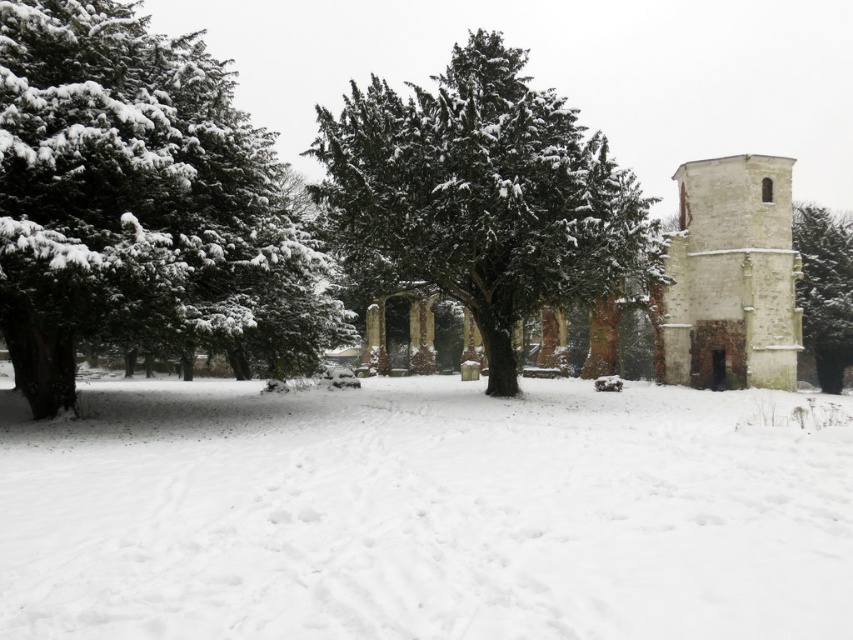
Does snow-covered evergreen tree at center lie in front of green textured stone column at right?

Yes, snow-covered evergreen tree at center is in front of green textured stone column at right.

Does point (492, 340) lie in front of point (813, 250)?

Yes, point (492, 340) is closer to viewer.

Identify the location of snow-covered evergreen tree at center. (480, 195).

Does point (456, 589) come in front of point (6, 205)?

Yes, point (456, 589) is closer to viewer.

Is white fluffy snow at center positioned behind green matte tree at left?

No, white fluffy snow at center is in front of green matte tree at left.

Between point (737, 572) and point (74, 260), which one is positioned behind?

Point (74, 260)

Where is `white fluffy snow at center`? The width and height of the screenshot is (853, 640). white fluffy snow at center is located at coordinates (424, 513).

Is white fluffy snow at center positioned in front of white stone tower at right?

Yes, white fluffy snow at center is closer to the viewer.

Is point (183, 422) positioned in front of point (675, 324)?

Yes, point (183, 422) is closer to viewer.

Which is behind, point (283, 561) or point (674, 296)?

Point (674, 296)

Locate an element on the screen. This screenshot has width=853, height=640. white fluffy snow at center is located at coordinates (424, 513).